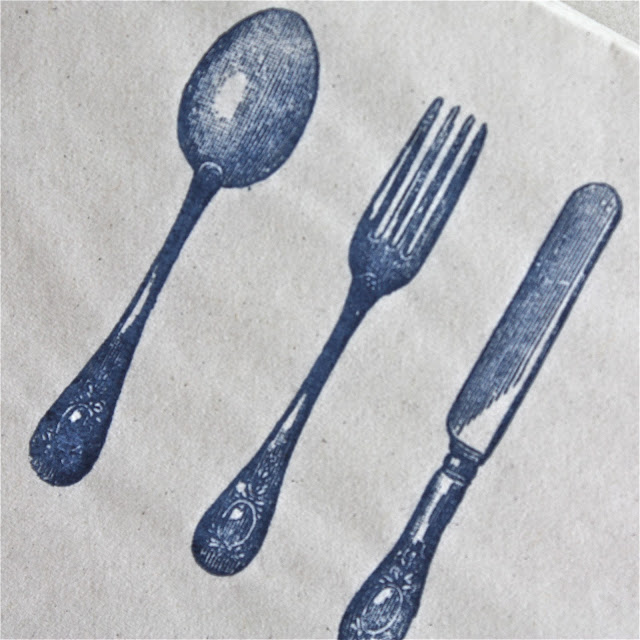
Find the location of a particular element. artist rendition of a spoon, fork and knife is located at coordinates (223, 170), (374, 273), (508, 346).